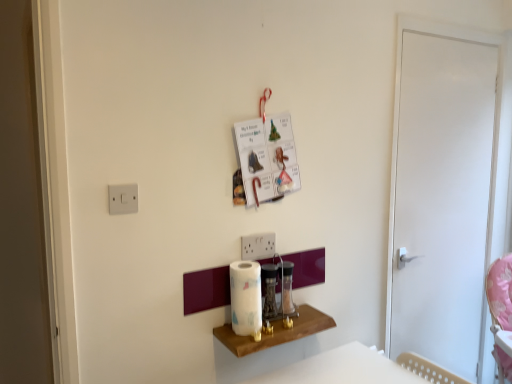
Find the location of a particular element. The height and width of the screenshot is (384, 512). free point in front of clear glass jar at center, which is counted as the 1th appliance, starting from the right is located at coordinates (279, 328).